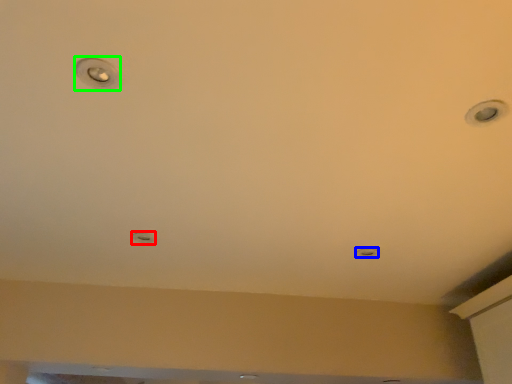
Question: Which object is positioned closest to droplight (highlighted by a red box)? Select from light (highlighted by a blue box) and droplight (highlighted by a green box).

Choices:
 (A) light
 (B) droplight

Answer: (B)